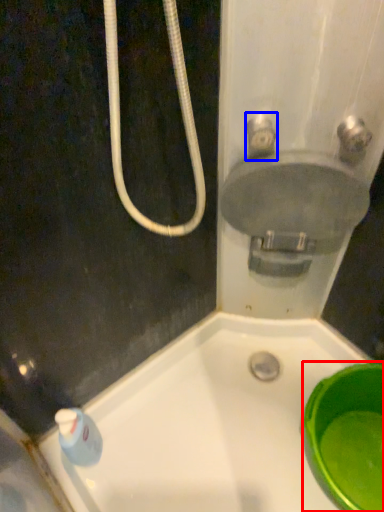
Question: Which point is further to the camera, basin (highlighted by a red box) or plumbing fixture (highlighted by a blue box)?

Choices:
 (A) basin
 (B) plumbing fixture

Answer: (A)